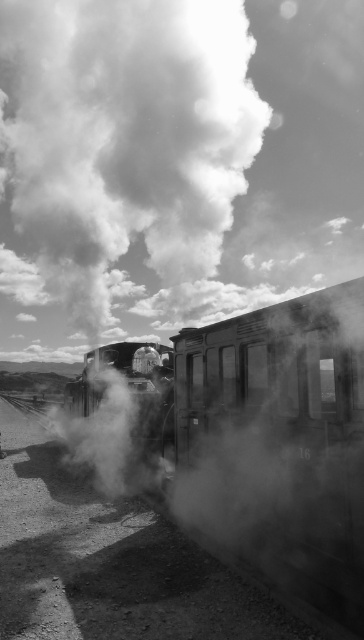
You are a photographer standing at the railway station. You want to take a closeup photo of the smooth metal train at center. If your camera can focus on objects within 3 meters, will you be able to take the closeup?

The smooth metal train at center is 4.05 meters away from the camera, which is beyond the 3 meter focusing range. Therefore, you cannot take a closeup photo with this camera.

In the scene shown: You are a railway worker who needs to inspect both the smooth metal train at center and the smooth metal steam engine at center. Given that your inspection tool has a 8 feet reach, can you inspect both objects without moving your position?

The smooth metal train at center and the smooth metal steam engine at center are 8.21 feet apart. Since your tool only reaches 8 feet, you cannot inspect both without moving your position.

You are a photographer standing at the railway station. You want to capture a clear photo of the smooth metal train at center without the white smoke at upper center blocking it. Is it possible to adjust your position so that the train is fully visible without the smoke obscuring it?

The smooth metal train at center is behind the white smoke at upper center, so adjusting your position might not eliminate the smoke obstruction. Since the train is behind the smoke, the smoke will likely still block part of the train in the photo unless you move to a position where the smoke is no longer between you and the train.